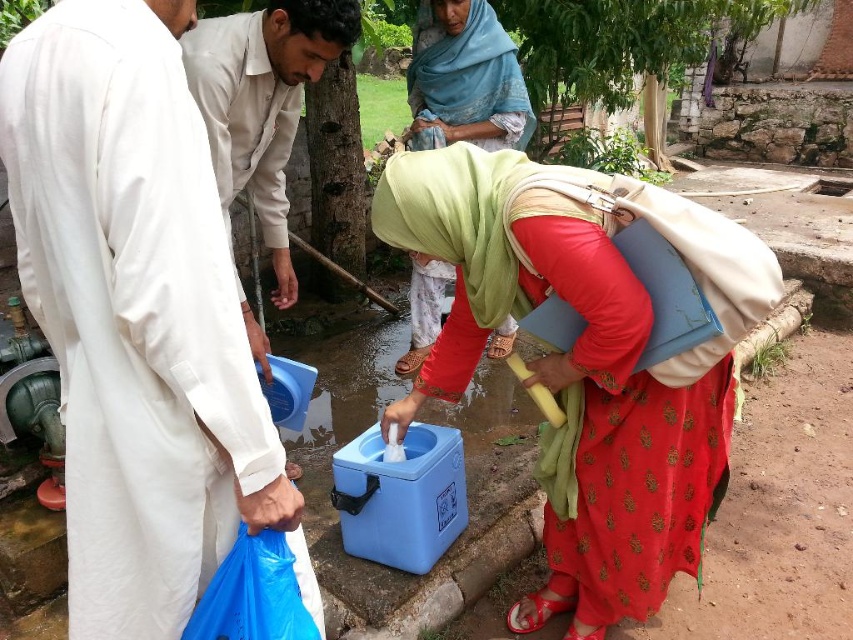
You are a photographer trying to capture the scene where the woman is interacting with the matte blue cooler at center and the matte green scarf at center. From the woman perspective, which object is on the right side?

The matte blue cooler at center is positioned on the right side of the matte green scarf at center, so from the woman perspective, the matte blue cooler at center is on the right side.

You are a photographer standing in front of the scene. You want to take a photo that includes both the white matte robe at left and the matte blue cooler at center. Which object should you focus on first to ensure both are in sharp focus?

You should focus on the white matte robe at left first because it is closer to the viewer than the matte blue cooler at center, so focusing on the closer object ensures both will be in focus with proper depth of field.

You are a photographer taking a picture of the beige cotton shirt at left and the matte green scarf at center. Which object should you focus on first if you want to capture both in sharp focus?

The beige cotton shirt at left is positioned under the matte green scarf at center, so focusing on the matte green scarf at center first would ensure both are in focus since it is closer to the camera.